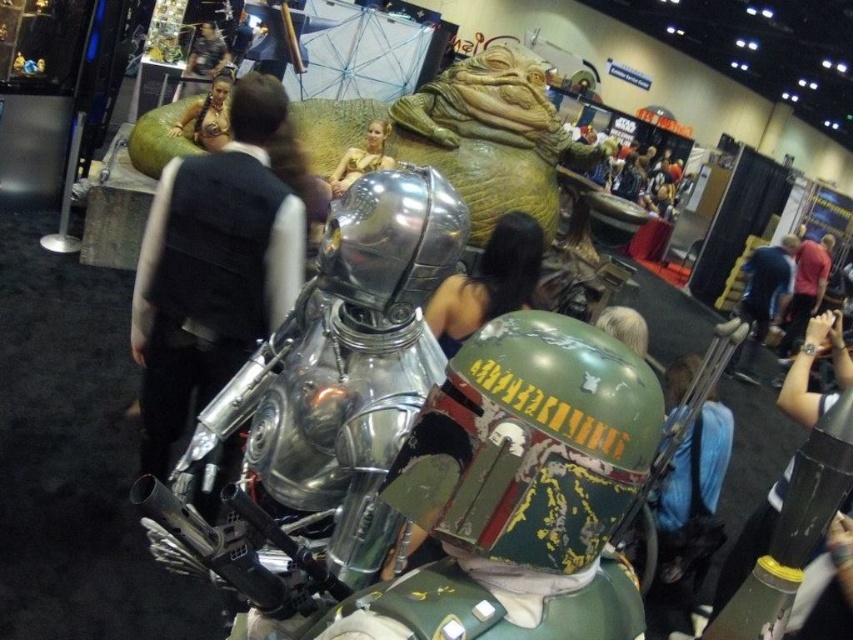
Which is above, blue fabric shirt at right or metallic gold bikini at upper center?

metallic gold bikini at upper center

Can you confirm if blue fabric shirt at right is bigger than metallic gold bikini at upper center?

Indeed, blue fabric shirt at right has a larger size compared to metallic gold bikini at upper center.

The height and width of the screenshot is (640, 853). In order to click on blue fabric shirt at right in this screenshot , I will do `click(762, 300)`.

Locate an element on the screen. The image size is (853, 640). blue fabric shirt at right is located at coordinates click(x=762, y=300).

Can you confirm if black fabric vest at center is bigger than blue fabric shirt at right?

Actually, black fabric vest at center might be smaller than blue fabric shirt at right.

In the scene shown: Which is more to the right, black fabric vest at center or blue fabric shirt at right?

blue fabric shirt at right

Is point (248, 300) positioned in front of point (786, 273)?

Yes, it is.

Find the location of `black fabric vest at center`. black fabric vest at center is located at coordinates (216, 262).

Does metallic silver helmet at center have a greater width compared to blue fabric shirt at right?

Incorrect, metallic silver helmet at center's width does not surpass blue fabric shirt at right's.

Describe the element at coordinates (810, 369) in the screenshot. I see `metallic silver helmet at center` at that location.

Is point (844, 365) positioned before point (752, 380)?

Yes, it is in front of point (752, 380).

Identify the location of metallic silver helmet at center. Image resolution: width=853 pixels, height=640 pixels. (810, 369).